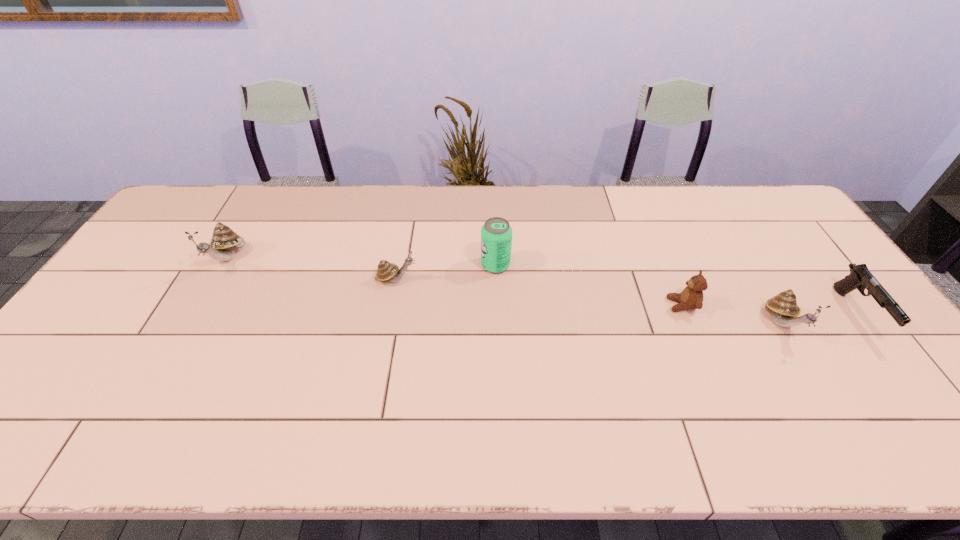
The height and width of the screenshot is (540, 960). I want to click on free space at the near edge of the desktop, so click(417, 383).

You are a GUI agent. You are given a task and a screenshot of the screen. Output one action in this format:
    pyautogui.click(x=<x>, y=<y>)
    Task: Click on the free space at the left edge
    
    Given the screenshot: What is the action you would take?
    pyautogui.click(x=104, y=323)

This screenshot has width=960, height=540. I want to click on vacant space at the right edge, so click(x=844, y=316).

Find the location of `free space at the far left corner of the desktop`. free space at the far left corner of the desktop is located at coordinates click(x=211, y=190).

Find the location of a particular element. Image resolution: width=960 pixels, height=540 pixels. free region at the near right corner of the desktop is located at coordinates (919, 383).

This screenshot has width=960, height=540. I want to click on vacant area that lies between the pop soda and the fifth object from right to left, so click(x=446, y=272).

Identify the location of vacant area between the pop soda and the leftmost object. (362, 262).

Where is `free space between the shortest snail and the gun`? This screenshot has height=540, width=960. free space between the shortest snail and the gun is located at coordinates (626, 296).

The height and width of the screenshot is (540, 960). I want to click on blank region between the rightmost snail and the third object from left to right, so click(x=639, y=294).

This screenshot has width=960, height=540. I want to click on free space between the second shortest snail and the leftmost snail, so click(505, 292).